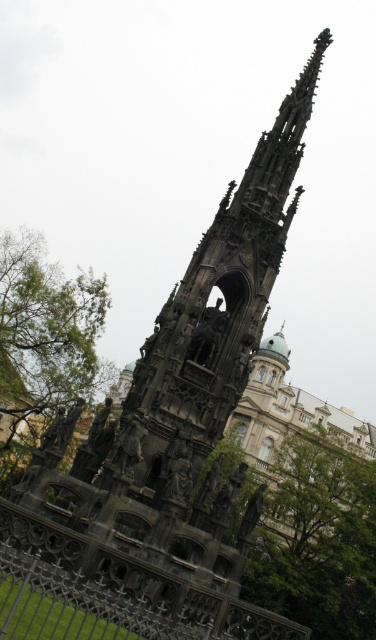
Question: Does green leafy tree at center lie in front of black wrought iron fence at lower left?

Choices:
 (A) no
 (B) yes

Answer: (A)

Question: Which of the following is the closest to the observer?

Choices:
 (A) (95, 316)
 (B) (285, 593)
 (C) (207, 621)

Answer: (C)

Question: Which of these objects is positioned closest to the green leafy tree at center?

Choices:
 (A) green leafy tree at left
 (B) black wrought iron fence at lower left

Answer: (A)

Question: Is green leafy tree at left to the right of black wrought iron fence at lower left from the viewer's perspective?

Choices:
 (A) yes
 (B) no

Answer: (B)

Question: Which point is farther to the camera?

Choices:
 (A) black wrought iron fence at lower left
 (B) green leafy tree at center
 (C) green leafy tree at left

Answer: (B)

Question: Is the position of green leafy tree at left less distant than that of black wrought iron fence at lower left?

Choices:
 (A) yes
 (B) no

Answer: (B)